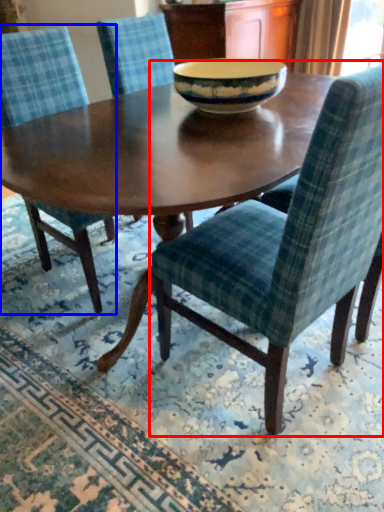
Question: Which object is closer to the camera taking this photo, chair (highlighted by a red box) or chair (highlighted by a blue box)?

Choices:
 (A) chair
 (B) chair

Answer: (A)